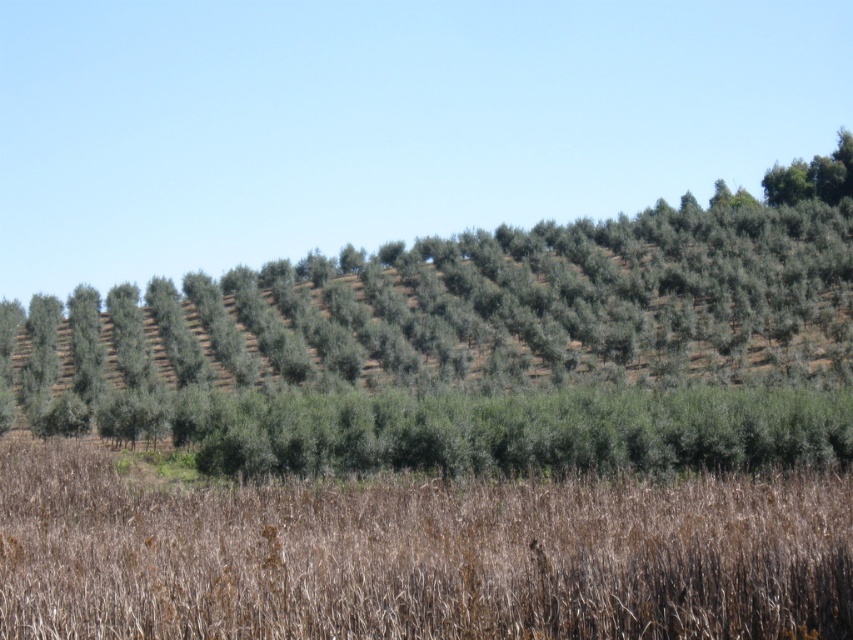
Question: Which object is closer to the camera taking this photo?

Choices:
 (A) green leafy trees at center
 (B) brown dry grass at lower center

Answer: (B)

Question: Does green leafy trees at center have a smaller size compared to brown dry grass at lower center?

Choices:
 (A) yes
 (B) no

Answer: (B)

Question: Does green leafy trees at center appear over brown dry grass at lower center?

Choices:
 (A) yes
 (B) no

Answer: (A)

Question: Which of the following is the closest to the observer?

Choices:
 (A) (740, 561)
 (B) (367, 381)

Answer: (A)

Question: Is green leafy trees at center bigger than brown dry grass at lower center?

Choices:
 (A) yes
 (B) no

Answer: (A)